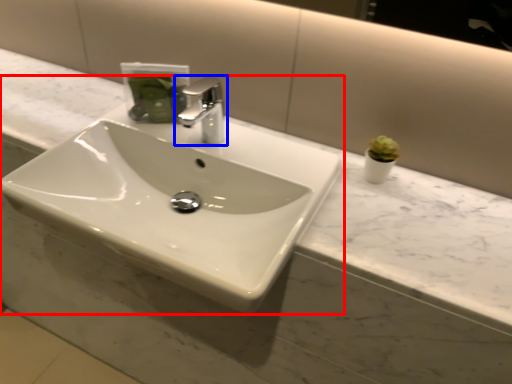
Question: Which object appears closest to the camera in this image, sink (highlighted by a red box) or tap (highlighted by a blue box)?

Choices:
 (A) sink
 (B) tap

Answer: (A)